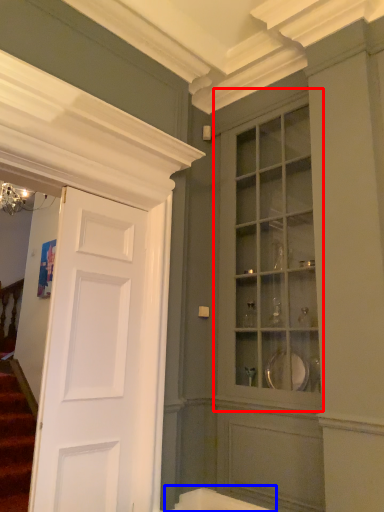
Question: Which of the following is the farthest to the observer, cabinetry (highlighted by a red box) or bath (highlighted by a blue box)?

Choices:
 (A) cabinetry
 (B) bath

Answer: (B)